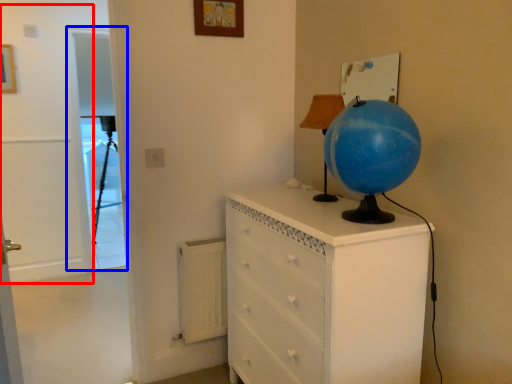
Question: Which object is further to the camera taking this photo, door (highlighted by a red box) or screen door (highlighted by a blue box)?

Choices:
 (A) door
 (B) screen door

Answer: (B)